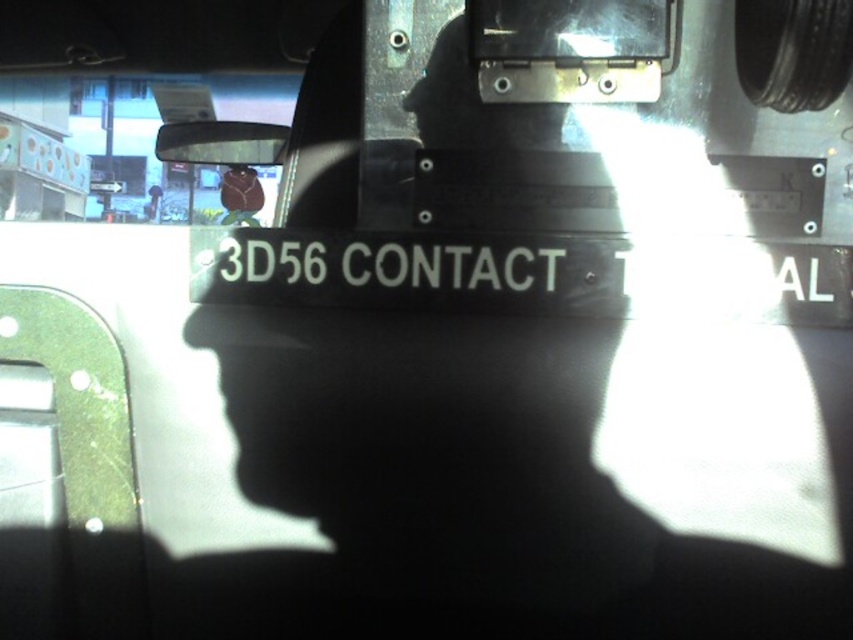
Can you confirm if white plastic sign at center is taller than clear plastic view mirror at upper left?

In fact, white plastic sign at center may be shorter than clear plastic view mirror at upper left.

Does point (245, 272) come in front of point (190, 136)?

Yes, it is in front of point (190, 136).

Find the location of a particular element. Image resolution: width=853 pixels, height=640 pixels. white plastic sign at center is located at coordinates (408, 272).